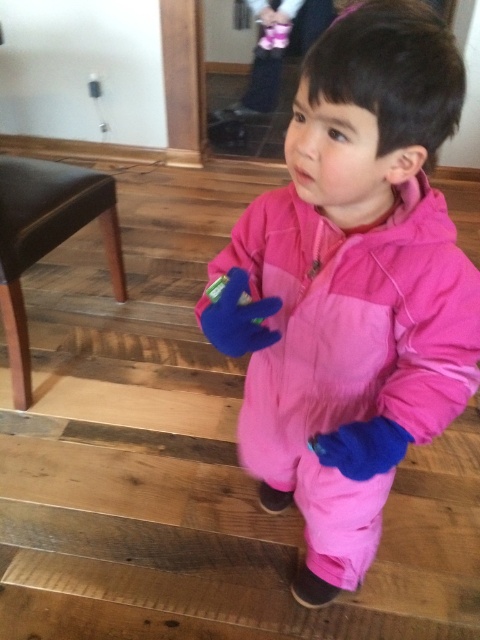
Question: Is pink fleece snowsuit at center in front of black leather stool at lower left?

Choices:
 (A) no
 (B) yes

Answer: (B)

Question: Which point is farther from the camera taking this photo?

Choices:
 (A) (4, 186)
 (B) (403, 300)

Answer: (A)

Question: Observing the image, what is the correct spatial positioning of pink fleece snowsuit at center in reference to black leather stool at lower left?

Choices:
 (A) above
 (B) below

Answer: (B)

Question: Can you confirm if pink fleece snowsuit at center is smaller than black leather stool at lower left?

Choices:
 (A) no
 (B) yes

Answer: (A)

Question: Which point is closer to the camera taking this photo?

Choices:
 (A) (108, 182)
 (B) (336, 470)

Answer: (B)

Question: Which of the following is the closest to the observer?

Choices:
 (A) pink fleece snowsuit at center
 (B) black leather stool at lower left

Answer: (A)